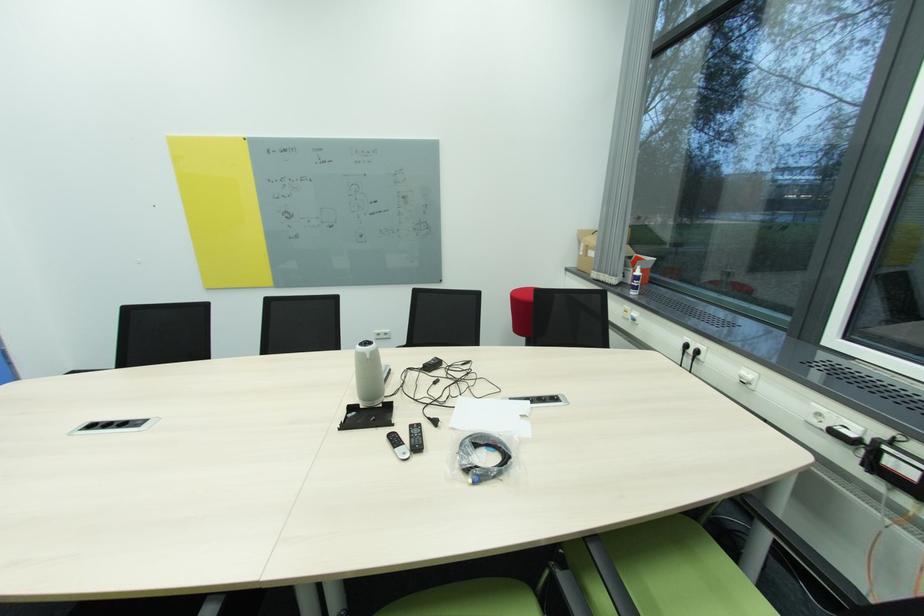
Find where to lift the gray conference speaker. Please return your answer as a coordinate pair (x, y).

(369, 374)